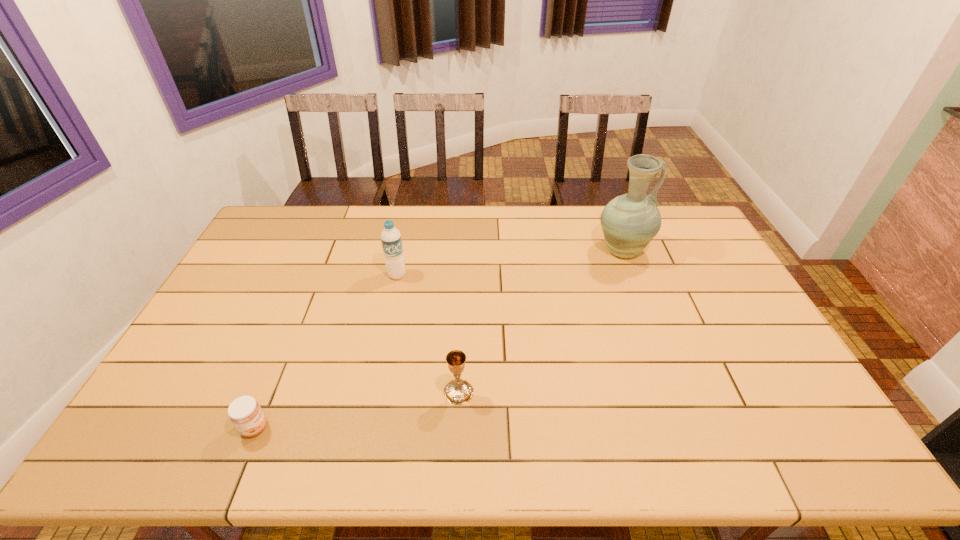
The image size is (960, 540). I want to click on the rightmost object, so click(630, 221).

The height and width of the screenshot is (540, 960). Find the location of `pitcher`. pitcher is located at coordinates (630, 221).

This screenshot has width=960, height=540. I want to click on the second tallest object, so click(x=391, y=240).

At what (x,y) coordinates should I click in order to perform the action: click on water bottle. Please return your answer as a coordinate pair (x, y). This screenshot has width=960, height=540. Looking at the image, I should click on (391, 240).

Where is `the second shortest object`? Image resolution: width=960 pixels, height=540 pixels. the second shortest object is located at coordinates (458, 392).

At what (x,y) coordinates should I click in order to perform the action: click on chalice. Please return your answer as a coordinate pair (x, y). Image resolution: width=960 pixels, height=540 pixels. Looking at the image, I should click on (458, 392).

Locate an element on the screen. This screenshot has width=960, height=540. the leftmost object is located at coordinates coord(245,413).

Locate an element on the screen. jam is located at coordinates (245, 413).

Where is `vacant space situated 0.150m on the handle side of the rightmost object`? The height and width of the screenshot is (540, 960). vacant space situated 0.150m on the handle side of the rightmost object is located at coordinates (692, 251).

At what (x,y) coordinates should I click in order to perform the action: click on vacant area situated 0.210m on the label of the third object from right to left. Please return your answer as a coordinate pair (x, y). The image size is (960, 540). Looking at the image, I should click on (386, 330).